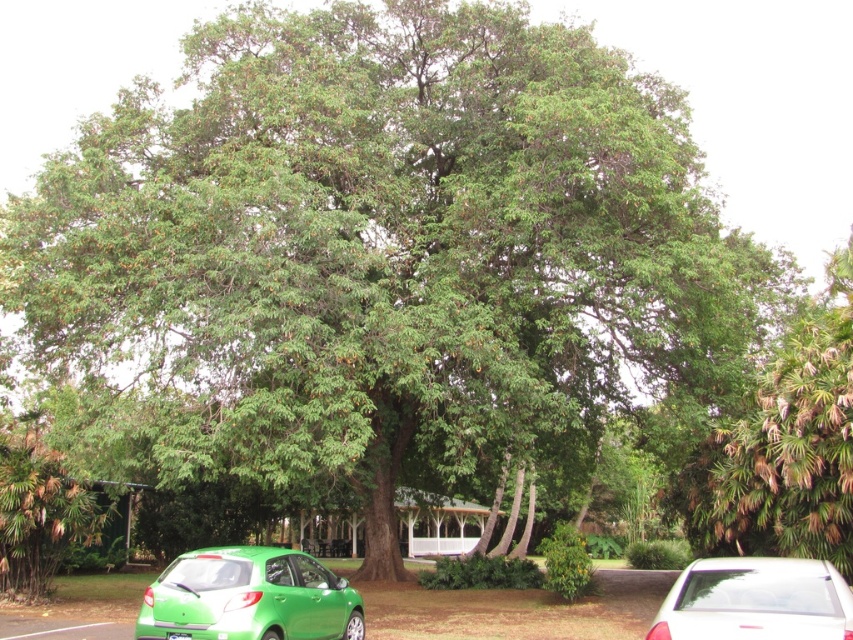
You are standing at the center of the image and want to walk towards the green matte hatchback at lower left. Which direction should you move in to reach it?

The green matte hatchback at lower left is located at point (248, 596), so you should move towards the lower left direction to reach it.

From the picture: You are a delivery person trying to park your car in a tight space. You see the green matte hatchback at lower left and the green plastic license plate at lower center in the image. Which object is narrower?

The green matte hatchback at lower left is narrower than the green plastic license plate at lower center.